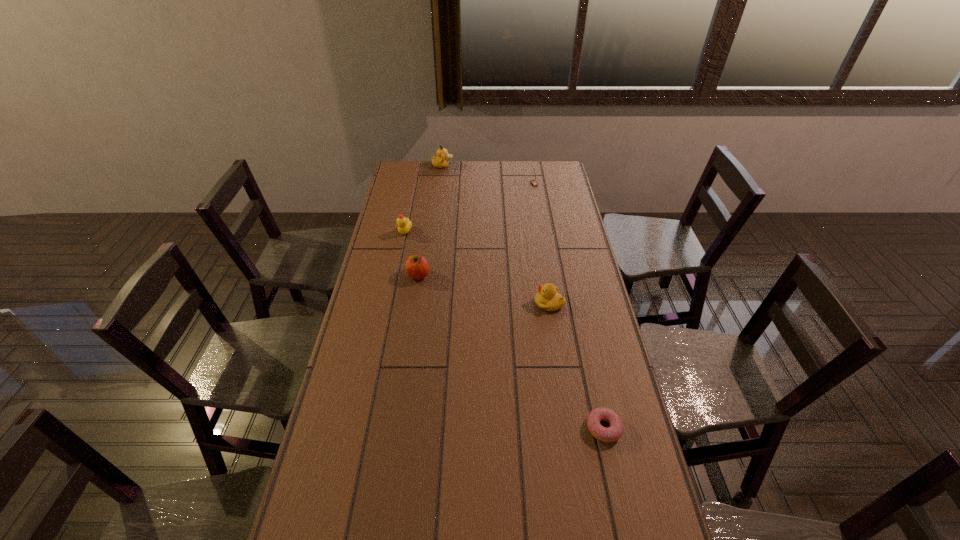
Identify which object is the fourth closest to the fourth nearest object. Please provide its 2D coordinates. Your answer should be formatted as a tuple, i.e. [(x, y)], where the tuple contains the x and y coordinates of a point satisfying the conditions above.

[(533, 182)]

The height and width of the screenshot is (540, 960). I want to click on object that can be found as the closest to the second nearest duckling, so click(417, 267).

The width and height of the screenshot is (960, 540). Find the location of `the closest duckling to the nearest duckling`. the closest duckling to the nearest duckling is located at coordinates (404, 225).

Identify which duckling is located as the nearest to the matchbox. Please provide its 2D coordinates. Your answer should be formatted as a tuple, i.e. [(x, y)], where the tuple contains the x and y coordinates of a point satisfying the conditions above.

[(440, 161)]

Locate an element on the screen. This screenshot has width=960, height=540. free spot that satisfies the following two spatial constraints: 1. on the face of the nearest object; 2. on the left side of the second duckling from right to left is located at coordinates (410, 428).

Identify the location of vacant space that satisfies the following two spatial constraints: 1. on the face of the second duckling from right to left; 2. on the left side of the shortest object. (410, 428).

Where is `free space that satisfies the following two spatial constraints: 1. on the front-facing side of the fifth farthest object; 2. on the back side of the nearest object`? The width and height of the screenshot is (960, 540). free space that satisfies the following two spatial constraints: 1. on the front-facing side of the fifth farthest object; 2. on the back side of the nearest object is located at coordinates (569, 428).

This screenshot has height=540, width=960. Identify the location of vacant region that satisfies the following two spatial constraints: 1. on the front side of the matchbox; 2. on the front-facing side of the fifth farthest object. (555, 303).

This screenshot has height=540, width=960. I want to click on vacant region that satisfies the following two spatial constraints: 1. on the front-facing side of the rightmost duckling; 2. on the right side of the shortest object, so (569, 428).